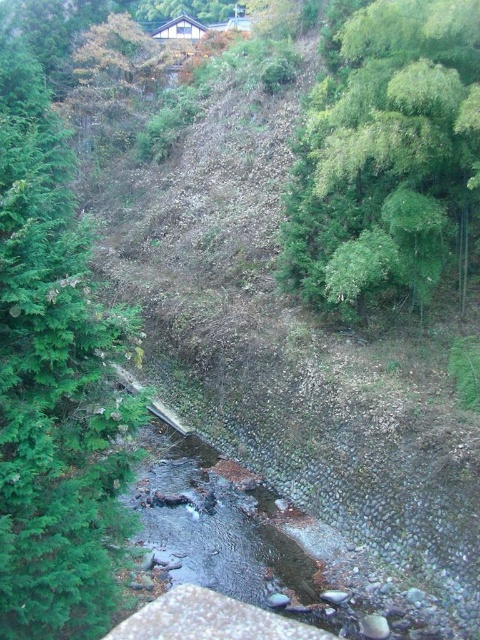
Question: Is green textured tree at left above green leafy tree at upper right?

Choices:
 (A) yes
 (B) no

Answer: (B)

Question: From the image, what is the correct spatial relationship of green textured tree at left in relation to green leafy tree at upper right?

Choices:
 (A) below
 (B) above

Answer: (A)

Question: Where is green textured tree at left located in relation to green leafy tree at upper right in the image?

Choices:
 (A) above
 (B) below

Answer: (B)

Question: Which object is closer to the camera taking this photo?

Choices:
 (A) green textured tree at left
 (B) green leafy tree at upper right

Answer: (A)